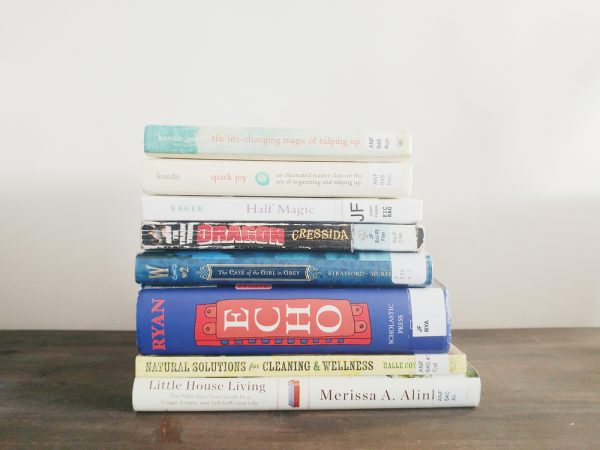
Where is `book spine label`? The height and width of the screenshot is (450, 600). book spine label is located at coordinates (220, 387), (223, 364), (238, 327), (255, 270), (259, 232), (262, 200), (240, 171), (255, 144).